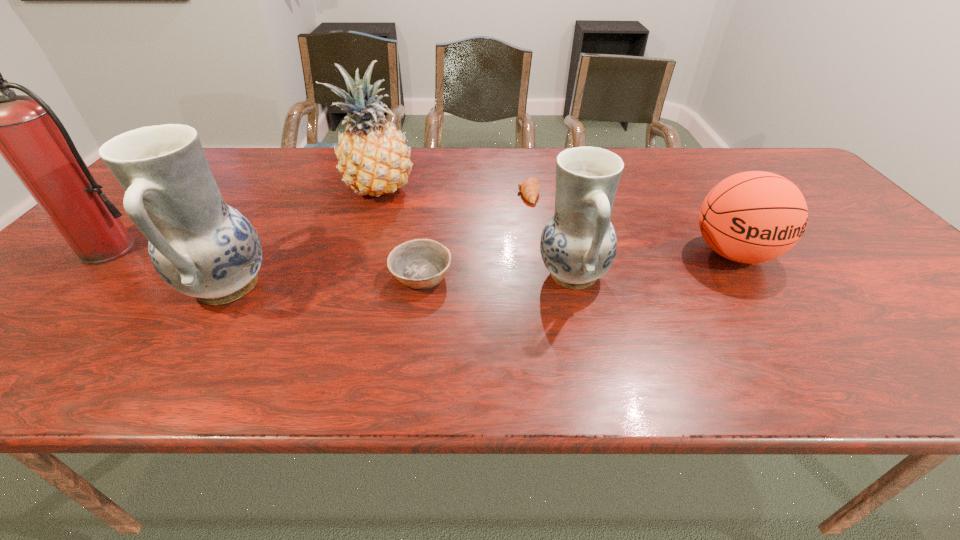
Find the location of `vacant area at the far edge`. vacant area at the far edge is located at coordinates (464, 161).

Locate an element on the screen. This screenshot has width=960, height=540. vacant space at the near edge of the desktop is located at coordinates (311, 315).

Locate an element on the screen. This screenshot has height=540, width=960. vacant space at the right edge is located at coordinates [866, 264].

Identify the location of free location at the far right corner of the desktop. The width and height of the screenshot is (960, 540). (772, 158).

In the image, there is a desktop. Where is `vacant space at the near right corner`? Image resolution: width=960 pixels, height=540 pixels. vacant space at the near right corner is located at coordinates (934, 330).

You are a GUI agent. You are given a task and a screenshot of the screen. Output one action in this format:
    pyautogui.click(x=<x>, y=<y>)
    Task: Click on the unoccupied area between the sixth tallest object and the right pottery
    This screenshot has width=960, height=540.
    Given the screenshot: What is the action you would take?
    pyautogui.click(x=497, y=275)

This screenshot has height=540, width=960. I want to click on vacant point located between the fourth tallest object and the basketball, so click(653, 264).

Locate an element on the screen. This screenshot has height=540, width=960. unoccupied area between the shorter pottery and the basketball is located at coordinates (653, 264).

Find the location of a particular element. This screenshot has width=960, height=540. vacant space that is in between the shortest object and the fifth tallest object is located at coordinates (631, 224).

This screenshot has height=540, width=960. What are the coordinates of `free space between the pineapple and the shortest object` in the screenshot? It's located at (453, 191).